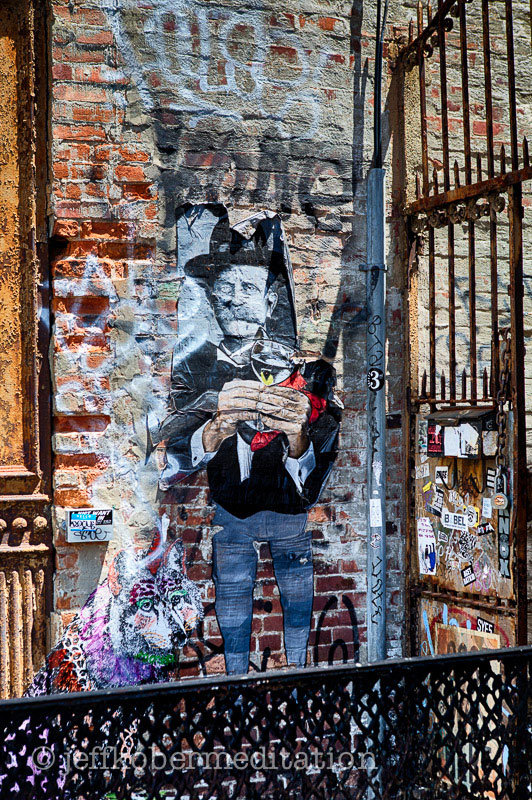
You are a GUI agent. You are given a task and a screenshot of the screen. Output one action in this format:
    pyautogui.click(x=<x>, y=<y>)
    Task: Click on the glass
    
    Given the screenshot: What is the action you would take?
    pyautogui.click(x=281, y=374)